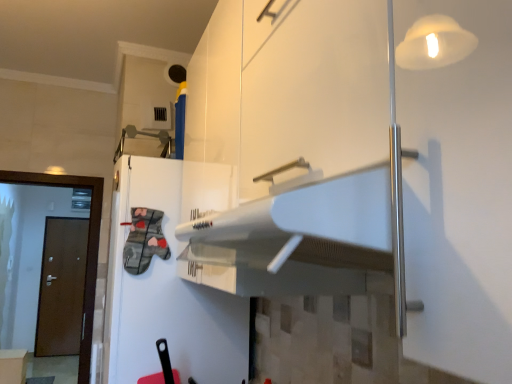
Question: Would you say white glossy refrigerator at center is to the left or to the right of brown wooden door at left, the second door when ordered from back to front, in the picture?

Choices:
 (A) left
 (B) right

Answer: (B)

Question: Considering their positions, is white glossy refrigerator at center located in front of or behind brown wooden door at left, the second door when ordered from back to front?

Choices:
 (A) behind
 (B) front

Answer: (B)

Question: Estimate the real-world distances between objects in this image. Which object is farther from the white glossy refrigerator at center?

Choices:
 (A) brown wooden door at left, the 1th door viewed from the right
 (B) white glossy cabinet at upper center, marked as the second cabinetry in a left-to-right arrangement
 (C) white glossy cabinet at lower left, the second cabinetry when ordered from front to back
 (D) brown wooden door at left, which is counted as the second door, starting from the front

Answer: (D)

Question: Estimate the real-world distances between objects in this image. Which object is farther from the brown wooden door at left, acting as the 2th door starting from the left?

Choices:
 (A) white glossy refrigerator at center
 (B) white glossy cabinet at lower left, positioned as the first cabinetry in back-to-front order
 (C) white glossy cabinet at upper center, which is counted as the first cabinetry, starting from the front
 (D) brown wooden door at left, placed as the first door when sorted from back to front

Answer: (D)